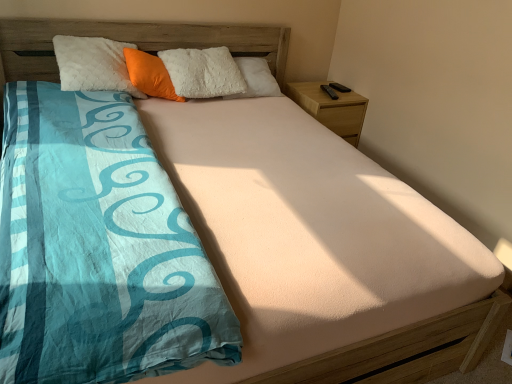
Question: Is wooden nightstand at right taller or shorter than orange plush pillow at upper center?

Choices:
 (A) short
 (B) tall

Answer: (B)

Question: Is wooden nightstand at right bigger or smaller than orange plush pillow at upper center?

Choices:
 (A) big
 (B) small

Answer: (A)

Question: From the image's perspective, is wooden nightstand at right above or below orange plush pillow at upper center?

Choices:
 (A) below
 (B) above

Answer: (A)

Question: Is orange plush pillow at upper center wider or thinner than wooden nightstand at right?

Choices:
 (A) thin
 (B) wide

Answer: (A)

Question: Is orange plush pillow at upper center in front of or behind wooden nightstand at right in the image?

Choices:
 (A) front
 (B) behind

Answer: (A)

Question: In terms of size, does orange plush pillow at upper center appear bigger or smaller than wooden nightstand at right?

Choices:
 (A) small
 (B) big

Answer: (A)

Question: From a real-world perspective, is orange plush pillow at upper center above or below wooden nightstand at right?

Choices:
 (A) below
 (B) above

Answer: (B)